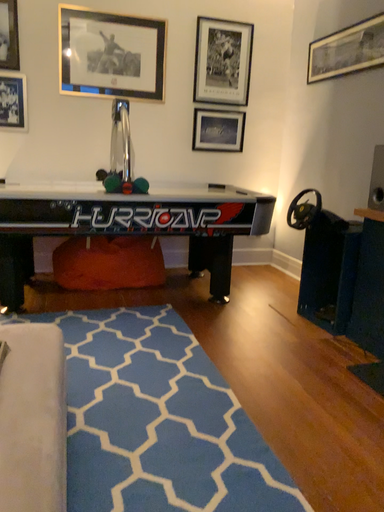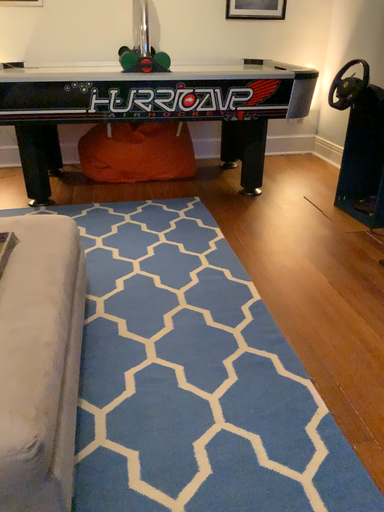
Question: Which way did the camera rotate in the video?

Choices:
 (A) rotated upward
 (B) rotated downward

Answer: (B)